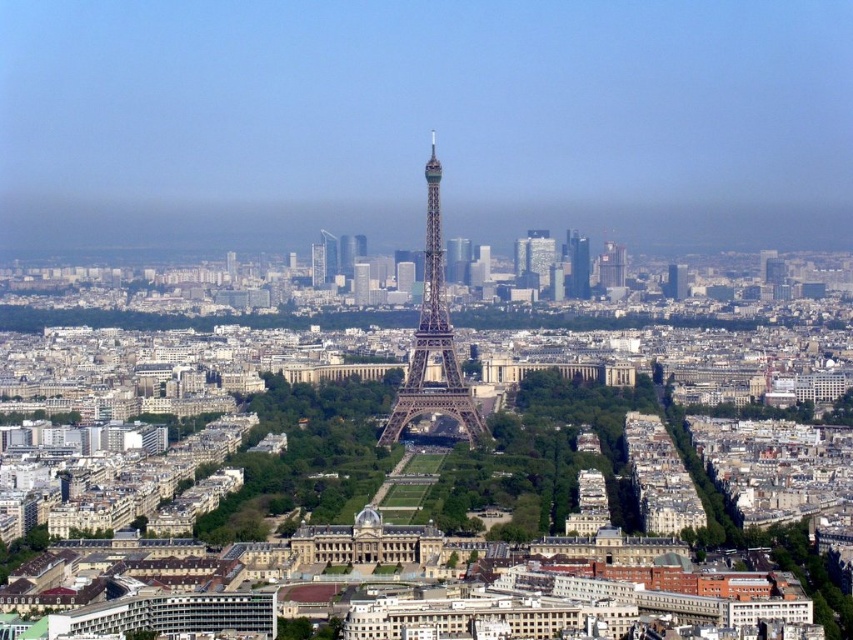
Is painted steel eiffel tower at center positioned behind smooth glass skyscraper at center?

No, painted steel eiffel tower at center is closer to the viewer.

Is painted steel eiffel tower at center thinner than smooth glass skyscraper at center?

No.

Does point (428, 396) come behind point (569, 259)?

No, (428, 396) is in front of (569, 259).

The height and width of the screenshot is (640, 853). What are the coordinates of `painted steel eiffel tower at center` in the screenshot? It's located at tap(433, 340).